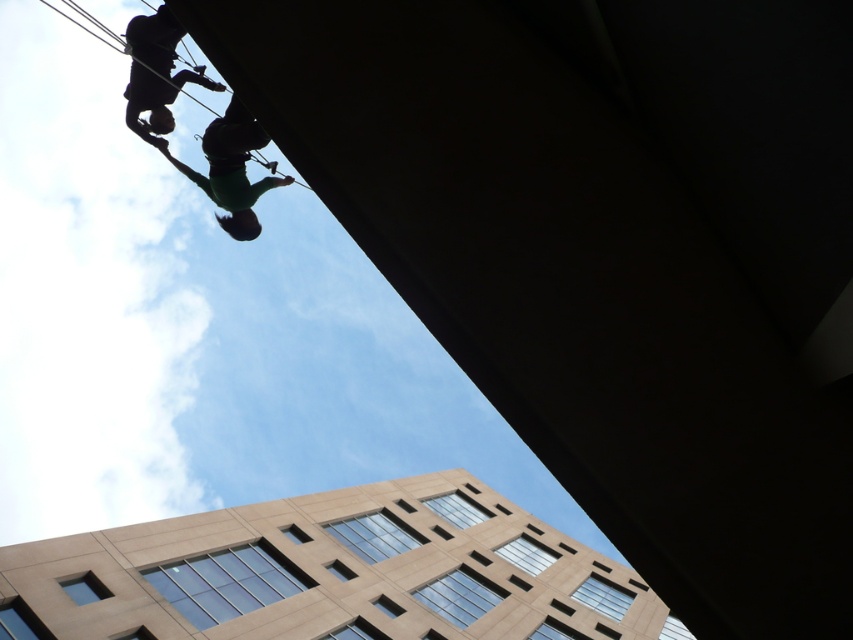
Does point (236, 227) lie in front of point (149, 44)?

No, (236, 227) is behind (149, 44).

Who is higher up, green fabric at upper center or black matte climbing harness at upper left?

black matte climbing harness at upper left

Find the location of a particular element. Image resolution: width=853 pixels, height=640 pixels. green fabric at upper center is located at coordinates (231, 168).